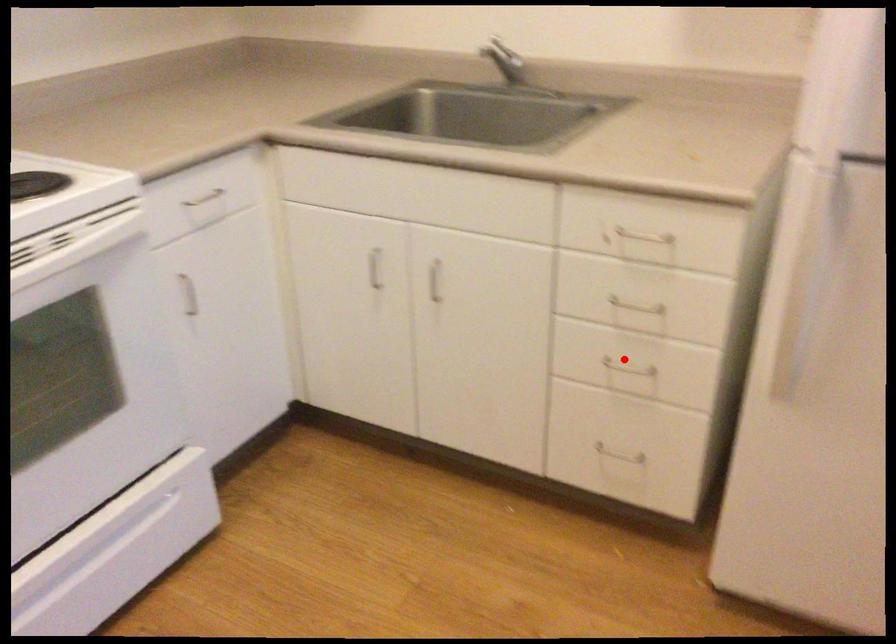
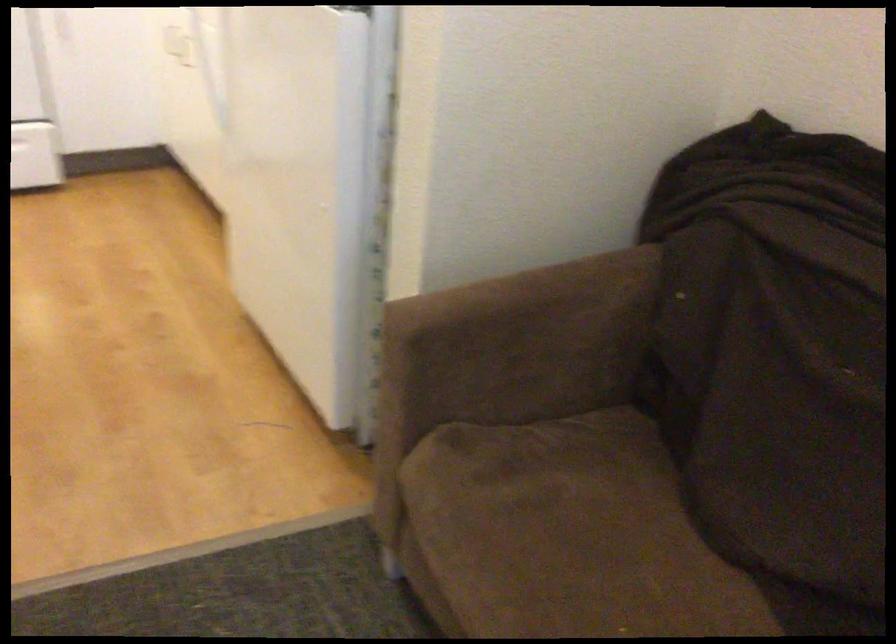
Question: I am providing you with two images of the same scene from different viewpoints. A red point is marked on the first image. Is the red point's position out of view in image 2?

Choices:
 (A) Yes
 (B) No

Answer: (A)